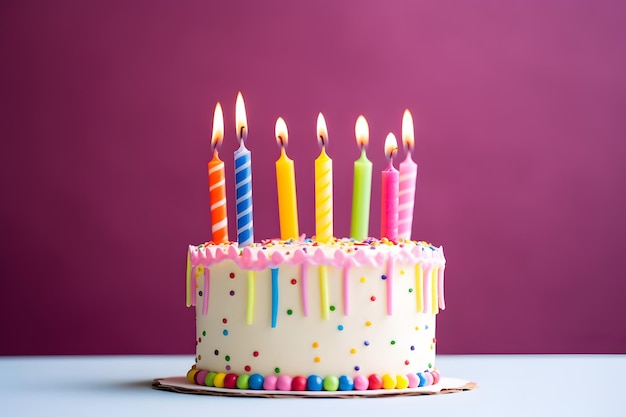
Image resolution: width=626 pixels, height=417 pixels. Find the location of `lit candles on a birthday cake`. lit candles on a birthday cake is located at coordinates (215, 198), (244, 211), (283, 202), (329, 208), (359, 211), (387, 210), (407, 188).